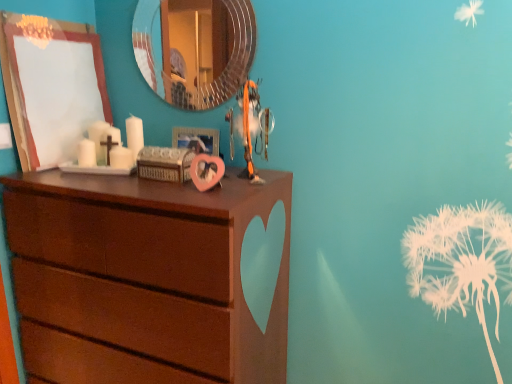
Question: Are pink matte heart-shaped frame at center, arranged as the 2th picture frame when viewed from the left, and metallic circular mirror at upper center making contact?

Choices:
 (A) yes
 (B) no

Answer: (B)

Question: Is pink matte heart-shaped frame at center, arranged as the 2th picture frame when viewed from the left, positioned with its back to metallic circular mirror at upper center?

Choices:
 (A) no
 (B) yes

Answer: (A)

Question: From a real-world perspective, does pink matte heart-shaped frame at center, arranged as the 2th picture frame when viewed from the left, sit lower than metallic circular mirror at upper center?

Choices:
 (A) yes
 (B) no

Answer: (A)

Question: Considering the relative sizes of pink matte heart-shaped frame at center, arranged as the 2th picture frame when viewed from the left, and metallic circular mirror at upper center in the image provided, is pink matte heart-shaped frame at center, arranged as the 2th picture frame when viewed from the left, bigger than metallic circular mirror at upper center?

Choices:
 (A) yes
 (B) no

Answer: (B)

Question: Can you confirm if pink matte heart-shaped frame at center, marked as the first picture frame in a right-to-left arrangement, is thinner than metallic circular mirror at upper center?

Choices:
 (A) no
 (B) yes

Answer: (A)

Question: Does pink matte heart-shaped frame at center, marked as the first picture frame in a right-to-left arrangement, have a greater height compared to metallic circular mirror at upper center?

Choices:
 (A) no
 (B) yes

Answer: (A)

Question: Is wooden picture frame at upper left, the second picture frame in the right-to-left sequence, a part of orange fabric toy at center?

Choices:
 (A) no
 (B) yes

Answer: (A)

Question: From the image's perspective, is orange fabric toy at center over wooden picture frame at upper left, the second picture frame in the right-to-left sequence?

Choices:
 (A) yes
 (B) no

Answer: (B)

Question: Is orange fabric toy at center closer to camera compared to wooden picture frame at upper left, which is the first picture frame from left to right?

Choices:
 (A) yes
 (B) no

Answer: (A)

Question: From a real-world perspective, does orange fabric toy at center stand above wooden picture frame at upper left, which is the first picture frame from left to right?

Choices:
 (A) yes
 (B) no

Answer: (B)

Question: From a real-world perspective, is orange fabric toy at center under wooden picture frame at upper left, the second picture frame in the right-to-left sequence?

Choices:
 (A) no
 (B) yes

Answer: (B)

Question: Is orange fabric toy at center facing away from wooden picture frame at upper left, which is the first picture frame from left to right?

Choices:
 (A) yes
 (B) no

Answer: (B)

Question: Can you confirm if orange fabric toy at center is bigger than metallic circular mirror at upper center?

Choices:
 (A) yes
 (B) no

Answer: (A)